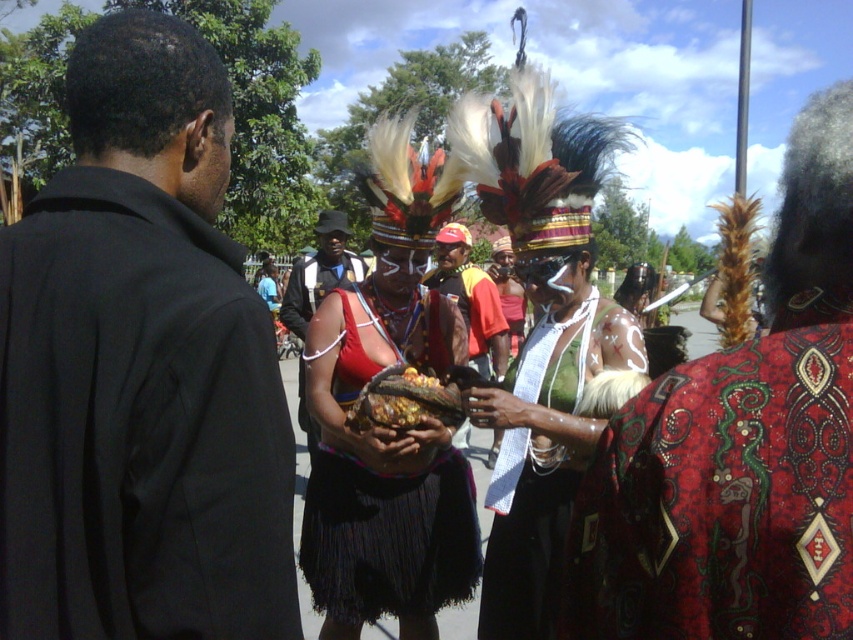
You are an event photographer at the ceremony. You need to capture a photo that includes both the matte red shirt at center and the matte red fabric at center. Which one should you focus on first to ensure it appears in the foreground of your photo?

The matte red shirt at center is located above the matte red fabric at center, so focusing on the matte red shirt at center first will place it in the foreground.

You are an event organizer planning to take photos of the participants. You notice two red items at the center of the scene, the matte red shirt at center and the matte red fabric at center. Which one appears bigger in the photo?

The matte red shirt at center has a larger size compared to the matte red fabric at center, so the matte red shirt at center appears bigger in the photo.